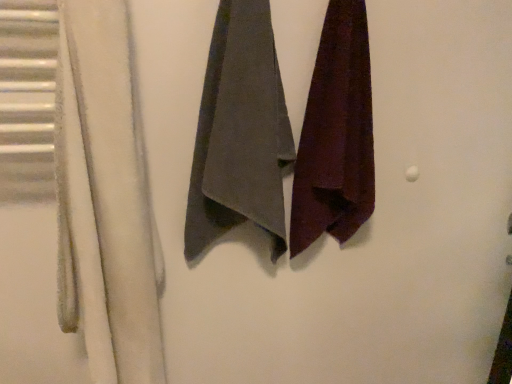
Question: Is velvet maroon towel at right, acting as the second towel starting from the left, far away from white fuzzy towel at left?

Choices:
 (A) yes
 (B) no

Answer: (B)

Question: Could you tell me if velvet maroon towel at right, positioned as the first towel in right-to-left order, is turned towards white fuzzy towel at left?

Choices:
 (A) yes
 (B) no

Answer: (B)

Question: Does velvet maroon towel at right, positioned as the first towel in right-to-left order, have a greater height compared to white fuzzy towel at left?

Choices:
 (A) no
 (B) yes

Answer: (A)

Question: Does velvet maroon towel at right, acting as the second towel starting from the left, have a smaller size compared to white fuzzy towel at left?

Choices:
 (A) no
 (B) yes

Answer: (B)

Question: Is the position of velvet maroon towel at right, positioned as the first towel in right-to-left order, more distant than that of white fuzzy towel at left?

Choices:
 (A) no
 (B) yes

Answer: (B)

Question: Can you confirm if velvet maroon towel at right, positioned as the first towel in right-to-left order, is positioned to the right of white fuzzy towel at left?

Choices:
 (A) no
 (B) yes

Answer: (B)

Question: From the image's perspective, is gray cotton towel at center, the 2th towel viewed from the right, located above white fuzzy towel at left?

Choices:
 (A) no
 (B) yes

Answer: (B)

Question: Can you confirm if gray cotton towel at center, the first towel positioned from the left, is bigger than white fuzzy towel at left?

Choices:
 (A) yes
 (B) no

Answer: (B)

Question: Is gray cotton towel at center, the 2th towel viewed from the right, to the left of white fuzzy towel at left from the viewer's perspective?

Choices:
 (A) yes
 (B) no

Answer: (B)

Question: Is gray cotton towel at center, the 2th towel viewed from the right, beside white fuzzy towel at left?

Choices:
 (A) no
 (B) yes

Answer: (A)

Question: Is white fuzzy towel at left at the back of gray cotton towel at center, the first towel positioned from the left?

Choices:
 (A) no
 (B) yes

Answer: (A)

Question: From a real-world perspective, is gray cotton towel at center, the 2th towel viewed from the right, under white fuzzy towel at left?

Choices:
 (A) yes
 (B) no

Answer: (B)

Question: Is white fuzzy towel at left touching velvet maroon towel at right, positioned as the first towel in right-to-left order?

Choices:
 (A) no
 (B) yes

Answer: (A)